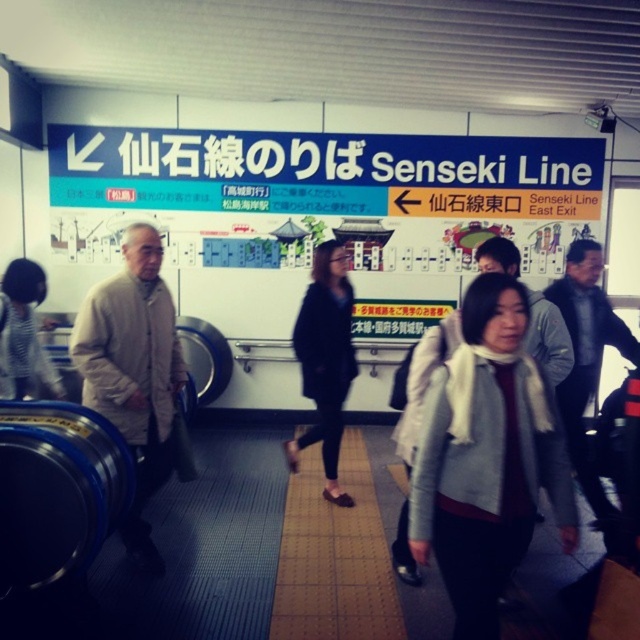
Question: Does light beige sweater at left appear on the left side of black leather jacket at center?

Choices:
 (A) yes
 (B) no

Answer: (A)

Question: Which object appears farthest from the camera in this image?

Choices:
 (A) light beige sweater at left
 (B) black leather jacket at center
 (C) white woolen scarf at center
 (D) striped fabric jacket at center

Answer: (B)

Question: Among these points, which one is farthest from the camera?

Choices:
 (A) (472, 324)
 (B) (328, 292)

Answer: (B)

Question: Does white woolen scarf at center appear on the right side of black leather jacket at center?

Choices:
 (A) yes
 (B) no

Answer: (A)

Question: Which of these objects is positioned closest to the striped fabric jacket at center?

Choices:
 (A) white woolen scarf at center
 (B) light beige sweater at left
 (C) black leather jacket at center

Answer: (B)

Question: Does white woolen scarf at center appear over light beige sweater at left?

Choices:
 (A) no
 (B) yes

Answer: (A)